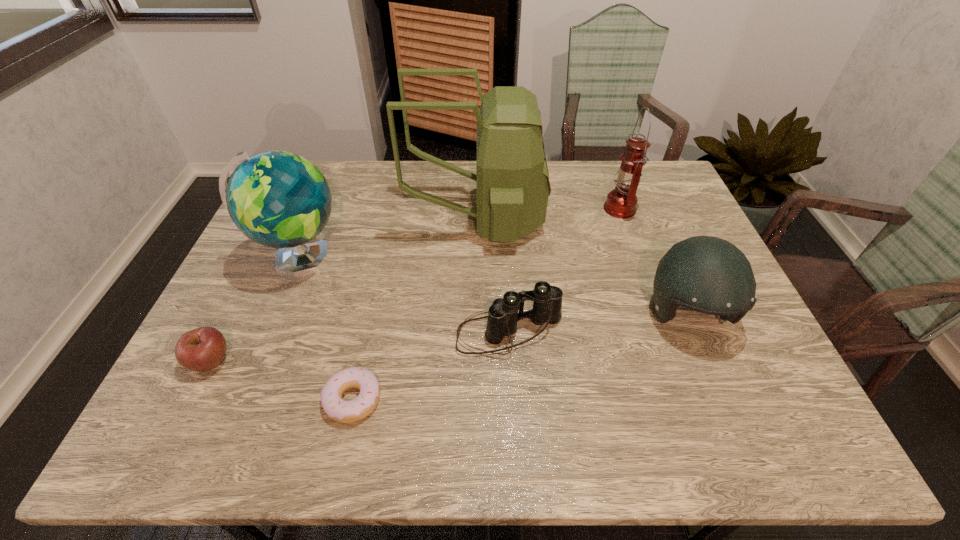
In order to click on vacant area between the globe and the backpack in this screenshot , I will do `click(388, 239)`.

The width and height of the screenshot is (960, 540). I want to click on vacant area that lies between the fourth tallest object and the oil lamp, so click(654, 262).

At what (x,y) coordinates should I click in order to perform the action: click on empty space between the oil lamp and the shortest object. Please return your answer as a coordinate pair (x, y). The image size is (960, 540). Looking at the image, I should click on 486,304.

At what (x,y) coordinates should I click in order to perform the action: click on vacant space in between the globe and the apple. Please return your answer as a coordinate pair (x, y). This screenshot has height=540, width=960. Looking at the image, I should click on (255, 309).

Locate an element on the screen. The height and width of the screenshot is (540, 960). vacant region between the globe and the football helmet is located at coordinates (493, 287).

The width and height of the screenshot is (960, 540). I want to click on object that stands as the closest to the football helmet, so click(503, 315).

Locate an element on the screen. This screenshot has height=540, width=960. the third closest object to the backpack is located at coordinates (621, 202).